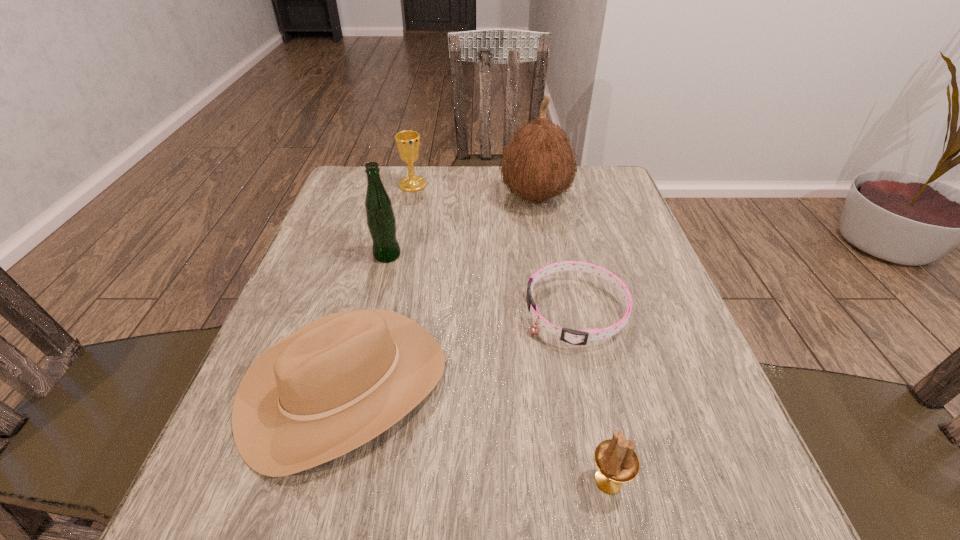
Locate an element on the screen. This screenshot has height=540, width=960. vacant space located on the back of the beer bottle is located at coordinates [405, 183].

You are a GUI agent. You are given a task and a screenshot of the screen. Output one action in this format:
    pyautogui.click(x=<x>, y=<y>)
    Task: Click on the vacant area located on the right of the chalice
    This screenshot has height=540, width=960.
    Given the screenshot: What is the action you would take?
    pyautogui.click(x=541, y=185)

Identify the location of vacant area situated on the right of the candle holder. The width and height of the screenshot is (960, 540). (756, 481).

The width and height of the screenshot is (960, 540). In order to click on vacant space situated 0.190m on the right of the cowboy hat in this screenshot , I will do `click(557, 386)`.

Identify the location of vacant space located 0.100m with the buckle on the dog collar. Image resolution: width=960 pixels, height=540 pixels. (475, 312).

At what (x,y) coordinates should I click in order to perform the action: click on free point located 0.150m with the buckle on the dog collar. Please return your answer as a coordinate pair (x, y). The height and width of the screenshot is (540, 960). Looking at the image, I should click on (450, 312).

Locate an element on the screen. This screenshot has width=960, height=540. vacant space situated 0.190m with the buckle on the dog collar is located at coordinates (430, 312).

Locate an element on the screen. coconut situated at the far edge is located at coordinates (538, 163).

This screenshot has width=960, height=540. Find the location of `chalice that is at the far edge`. chalice that is at the far edge is located at coordinates (407, 142).

The height and width of the screenshot is (540, 960). I want to click on candle holder that is positioned at the near edge, so click(x=616, y=460).